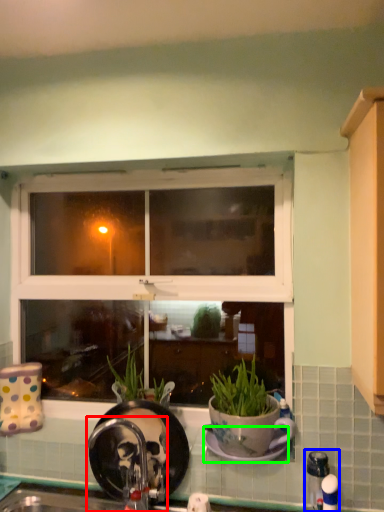
Question: Which object is the farthest from faucet (highlighted by a red box)? Choose among these: faucet (highlighted by a blue box) or plate (highlighted by a green box).

Choices:
 (A) faucet
 (B) plate

Answer: (A)